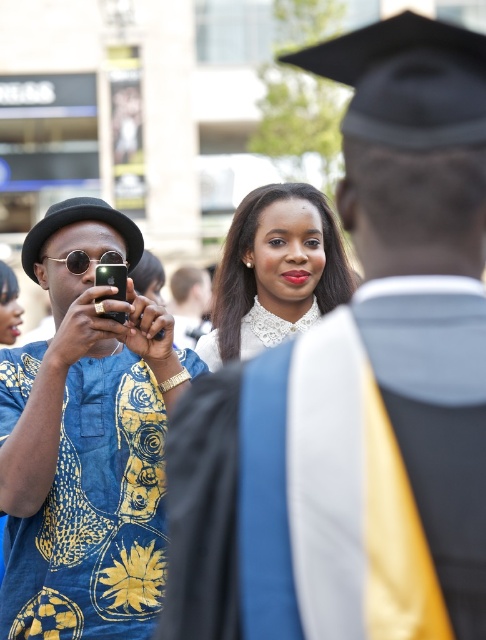
Who is lower down, blue patterned shirt at left or white lace collar at center?

blue patterned shirt at left

Which of these two, blue patterned shirt at left or white lace collar at center, stands taller?

With more height is blue patterned shirt at left.

Who is more distant from viewer, (320, 532) or (274, 260)?

The point (274, 260) is behind.

The height and width of the screenshot is (640, 486). In order to click on blue patterned shirt at left in this screenshot , I will do `click(354, 381)`.

Is point (364, 433) farther from viewer compared to point (144, 492)?

No, it is not.

Who is more forward, (277,442) or (90,358)?

Point (277,442)

Does point (295, 397) come farther from viewer compared to point (96, 563)?

No.

Where is `blue patterned shirt at left`? The image size is (486, 640). blue patterned shirt at left is located at coordinates (354, 381).

Which of these two, blue printed shirt at left or white lace collar at center, stands taller?

Standing taller between the two is blue printed shirt at left.

Is blue printed shirt at left thinner than white lace collar at center?

Yes, blue printed shirt at left is thinner than white lace collar at center.

You are a GUI agent. You are given a task and a screenshot of the screen. Output one action in this format:
    pyautogui.click(x=<x>, y=<y>)
    Task: Click on the blue printed shirt at left
    
    Given the screenshot: What is the action you would take?
    tap(86, 440)

Find the location of `blue printed shirt at left`. blue printed shirt at left is located at coordinates click(x=86, y=440).